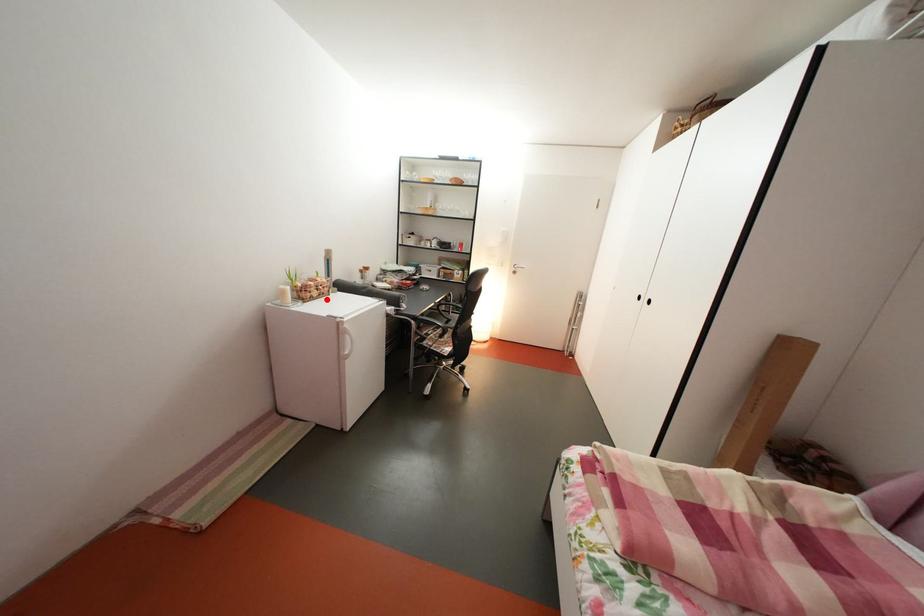
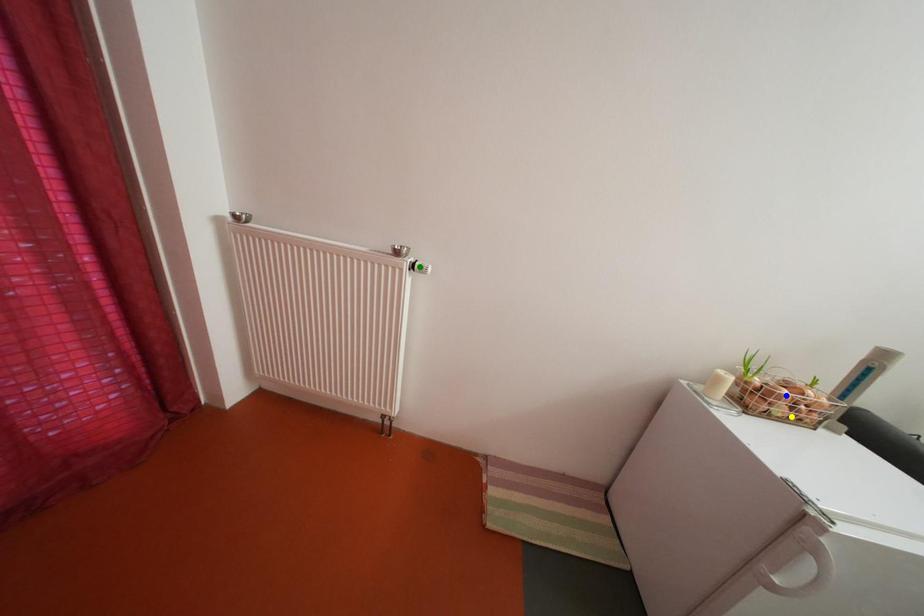
Question: I am providing you with two images of the same scene from different viewpoints. A red point is marked on the first image. You are given multiple points on the second image. Which point in image 2 is actually the same real-world point as the red point in image 1?

Choices:
 (A) yellow point
 (B) blue point
 (C) green point

Answer: (A)